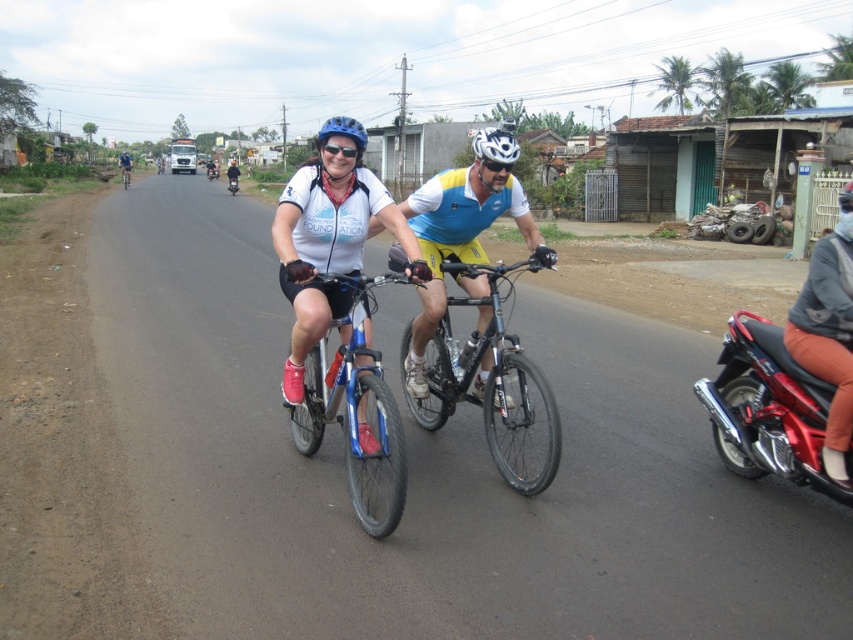
Does shiny metallic bicycle at center come behind matte blue helmet at center?

No, shiny metallic bicycle at center is in front of matte blue helmet at center.

Does shiny metallic bicycle at center appear under matte blue helmet at center?

Indeed, shiny metallic bicycle at center is positioned under matte blue helmet at center.

Between point (492, 275) and point (488, 145), which one is positioned behind?

The point (488, 145) is behind.

Identify the location of shiny metallic bicycle at center. (491, 378).

Does blue metallic bicycle at center have a greater width compared to transparent plastic goggles at center?

Indeed, blue metallic bicycle at center has a greater width compared to transparent plastic goggles at center.

Between blue metallic bicycle at center and transparent plastic goggles at center, which one is positioned lower?

blue metallic bicycle at center

Locate an element on the screen. The width and height of the screenshot is (853, 640). blue metallic bicycle at center is located at coordinates (354, 408).

Locate an element on the screen. Image resolution: width=853 pixels, height=640 pixels. blue metallic bicycle at center is located at coordinates (354, 408).

Consider the image. Who is more forward, (740, 390) or (358, 150)?

Point (358, 150) is more forward.

Is the position of shiny red motorcycle at right less distant than that of transparent plastic goggles at center?

Yes, it is in front of transparent plastic goggles at center.

Who is more forward, (759,449) or (357,147)?

Point (357,147) is more forward.

The image size is (853, 640). In order to click on shiny red motorcycle at right in this screenshot , I will do `click(767, 408)`.